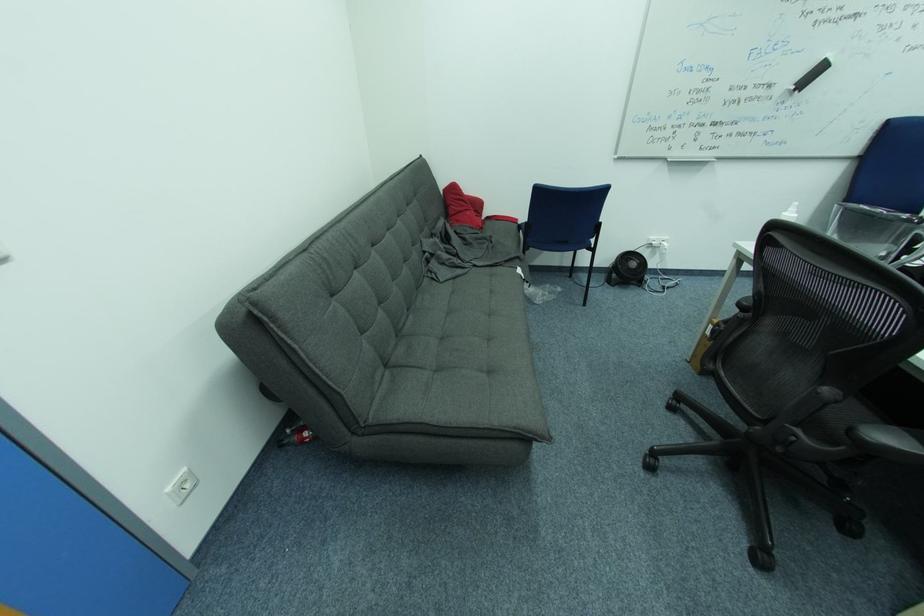
Describe the element at coordinates (888, 436) in the screenshot. The image size is (924, 616). I see `a black chair armrest` at that location.